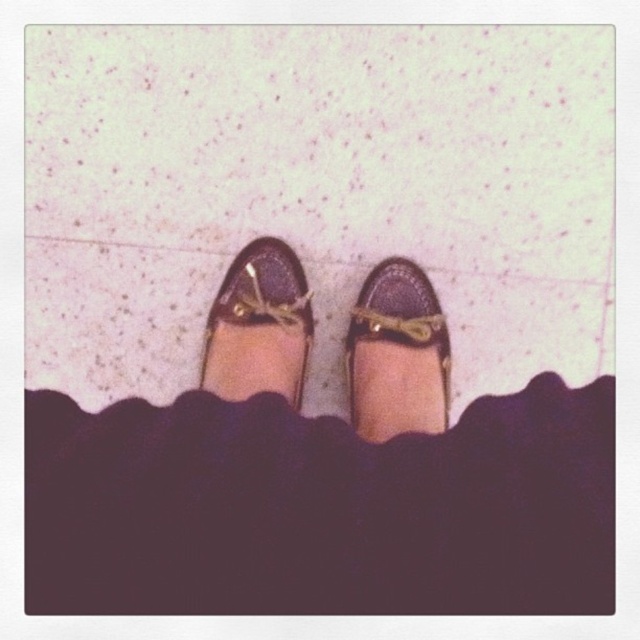
Does matte brown loafer at center have a lesser width compared to matte brown leather shoe at center?

Indeed, matte brown loafer at center has a lesser width compared to matte brown leather shoe at center.

Between matte brown loafer at center and matte brown leather shoe at center, which one is positioned higher?

Positioned higher is matte brown leather shoe at center.

The image size is (640, 640). Identify the location of matte brown loafer at center. (397, 353).

Does shiny brown shoes at center have a larger size compared to matte brown leather shoe at center?

Correct, shiny brown shoes at center is larger in size than matte brown leather shoe at center.

Can you confirm if shiny brown shoes at center is wider than matte brown leather shoe at center?

Indeed, shiny brown shoes at center has a greater width compared to matte brown leather shoe at center.

Find the location of a particular element. This screenshot has width=640, height=640. shiny brown shoes at center is located at coordinates (323, 474).

Is point (531, 604) less distant than point (356, 342)?

Yes, it is in front of point (356, 342).

You are a GUI agent. You are given a task and a screenshot of the screen. Output one action in this format:
    pyautogui.click(x=<x>, y=<y>)
    Task: Click on the shiny brown shoes at center
    The height and width of the screenshot is (640, 640).
    Given the screenshot: What is the action you would take?
    pyautogui.click(x=323, y=474)